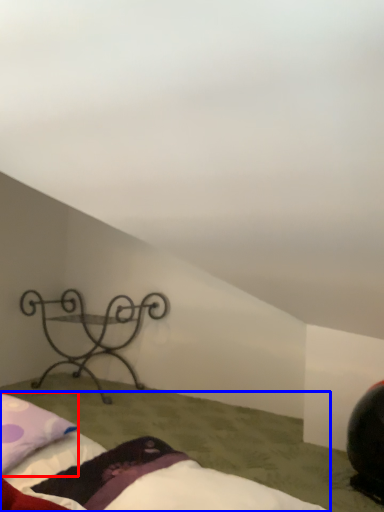
Question: Which point is further to the camera, pillow (highlighted by a red box) or bed (highlighted by a blue box)?

Choices:
 (A) pillow
 (B) bed

Answer: (A)